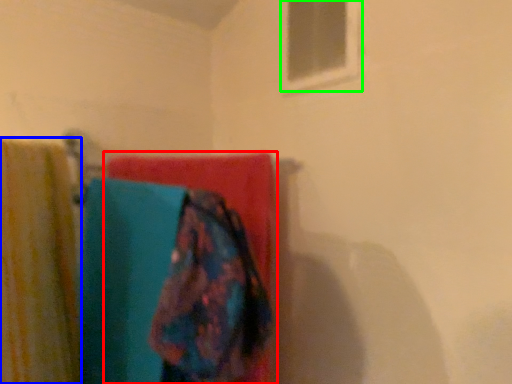
Question: Which object is the closest to the towel (highlighted by a red box)? Choose among these: curtain (highlighted by a blue box) or window (highlighted by a green box).

Choices:
 (A) curtain
 (B) window

Answer: (A)